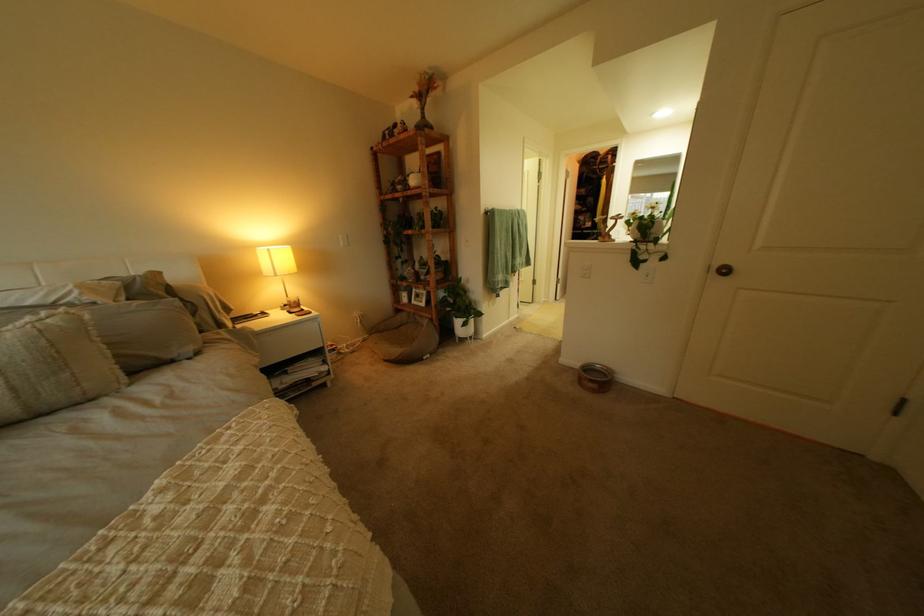
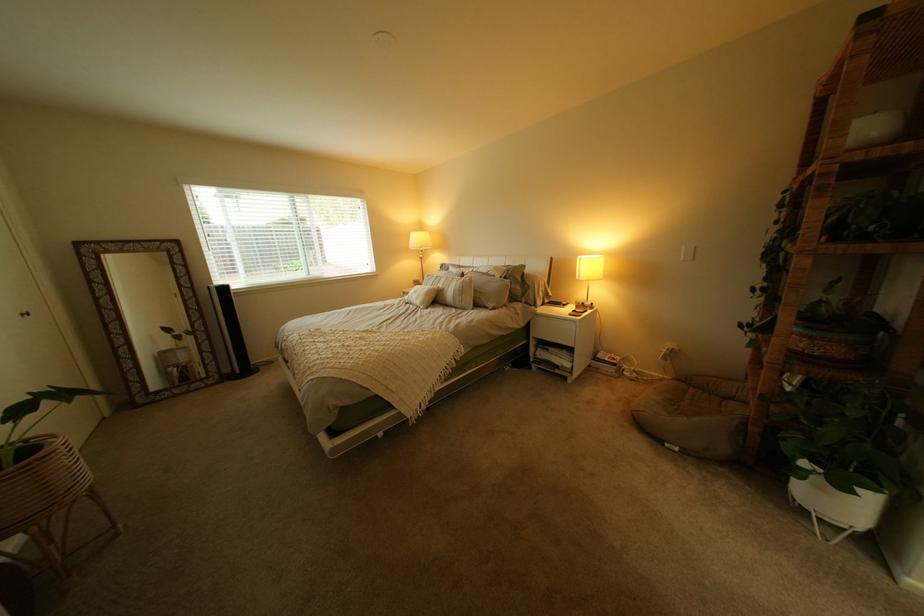
Where in the second image is the point corresponding to pixel 478 342 from the first image?

(821, 512)